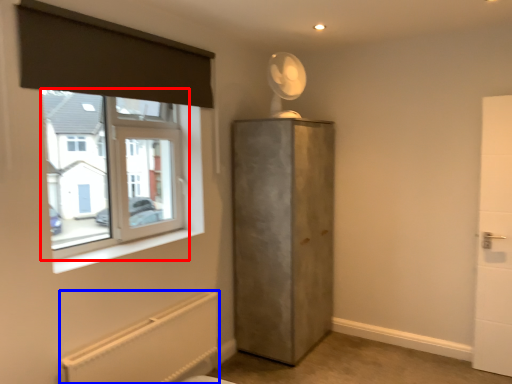
Question: Which of the following is the farthest to the observer, window (highlighted by a red box) or radiator (highlighted by a blue box)?

Choices:
 (A) window
 (B) radiator

Answer: (A)